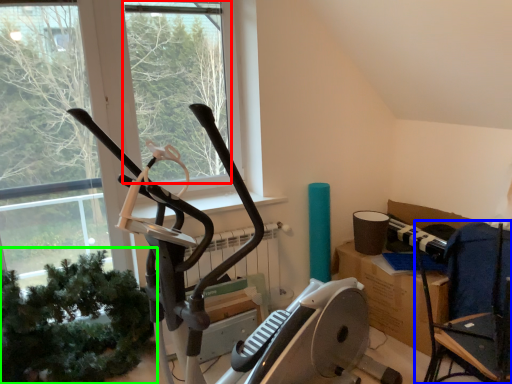
Question: Considering the real-world distances, which object is closest to window screen (highlighted by a red box)? chair (highlighted by a blue box) or plant (highlighted by a green box).

Choices:
 (A) chair
 (B) plant

Answer: (B)